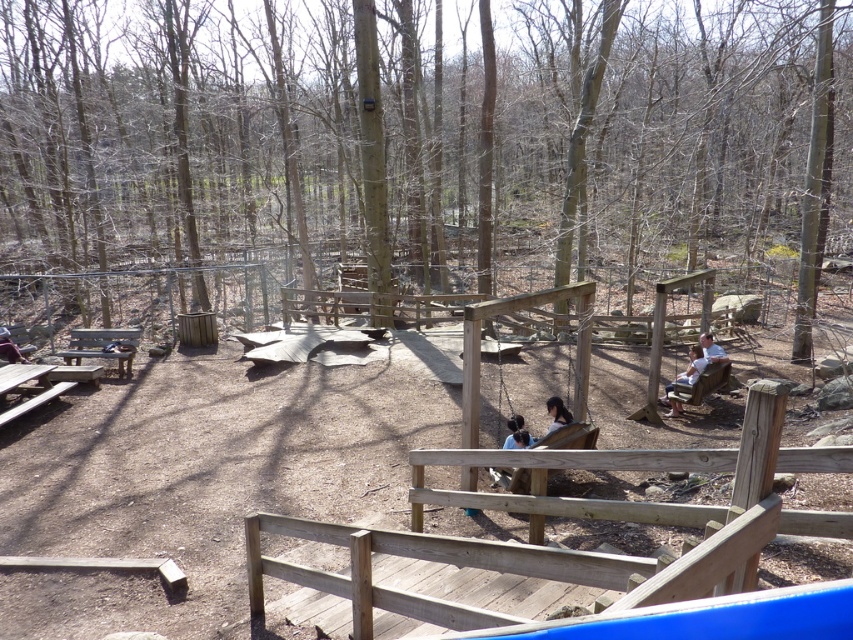
Between dark brown wooden swing at center and dark brown leather jacket at lower left, which one is positioned lower?

dark brown wooden swing at center is lower down.

Does dark brown wooden swing at center have a greater width compared to dark brown leather jacket at lower left?

→ In fact, dark brown wooden swing at center might be narrower than dark brown leather jacket at lower left.

Is point (556, 419) behind point (9, 360)?

No, (556, 419) is in front of (9, 360).

At what (x,y) coordinates should I click in order to perform the action: click on dark brown wooden swing at center. Please return your answer as a coordinate pair (x, y). The image size is (853, 640). Looking at the image, I should click on (517, 433).

Between light brown wooden bench at lower right and dark brown leather jacket at lower left, which one is positioned higher?

dark brown leather jacket at lower left is higher up.

Is light brown wooden bench at lower right wider than dark brown leather jacket at lower left?

Incorrect, light brown wooden bench at lower right's width does not surpass dark brown leather jacket at lower left's.

Where is `light brown wooden bench at lower right`? This screenshot has width=853, height=640. light brown wooden bench at lower right is located at coordinates point(685,378).

Where is `light brown wooden bench at lower right`? light brown wooden bench at lower right is located at coordinates (685, 378).

Between point (392, 600) and point (82, 332), which one is positioned behind?

Point (82, 332)

Find the location of a particular element. Image resolution: width=853 pixels, height=640 pixels. wooden swing at center is located at coordinates (573, 579).

Which is in front, point (659, 612) or point (77, 340)?

Point (659, 612) is in front.

Find the location of `wooden swing at center`. wooden swing at center is located at coordinates (573, 579).